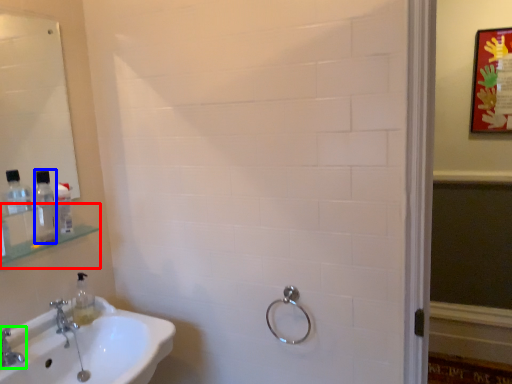
Question: Which object is the closest to the shelf (highlighted by a red box)? Choose among these: mouthwash (highlighted by a blue box) or tap (highlighted by a green box).

Choices:
 (A) mouthwash
 (B) tap

Answer: (A)